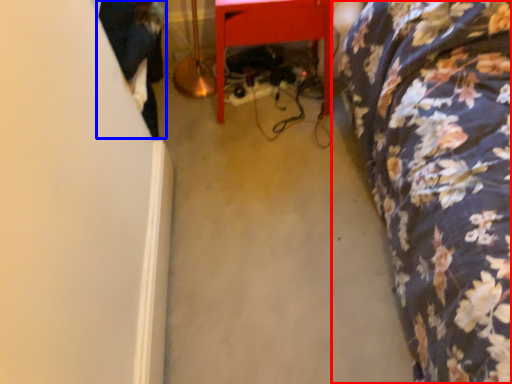
Question: Which object is further to the camera taking this photo, furniture (highlighted by a red box) or couple (highlighted by a blue box)?

Choices:
 (A) furniture
 (B) couple

Answer: (B)